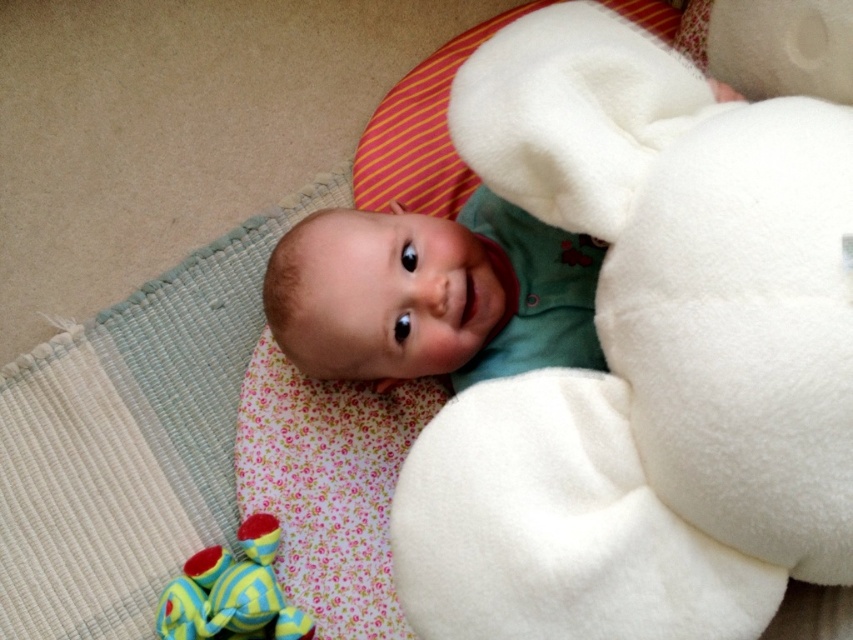
You are a photographer taking a picture of the green fleece baby at center. Where should you position your camera to ensure the baby is centered in the frame?

To center the green fleece baby at center in the frame, position the camera so that the baby is at the coordinates specified by the point (433,294), which is the 2D location of the baby in the image.

You are a photographer trying to capture the baby in the center of the image. The camera is currently focused on the point marked by point (433,294). Is the baby in the correct position for the photo?

Yes, the baby is in the correct position because point (433,294) marks the green fleece baby at center, so the camera is focused on the baby in the center of the image.